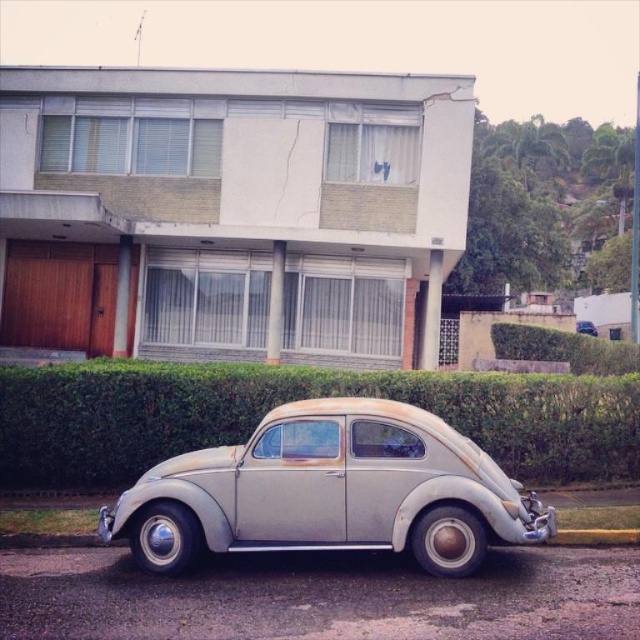
Is point (289, 480) in front of point (61, 461)?

Yes, point (289, 480) is in front of point (61, 461).

Between point (424, 518) and point (134, 477), which one is positioned in front?

Point (424, 518)

Where is `rusty metallic car at center`? rusty metallic car at center is located at coordinates (330, 492).